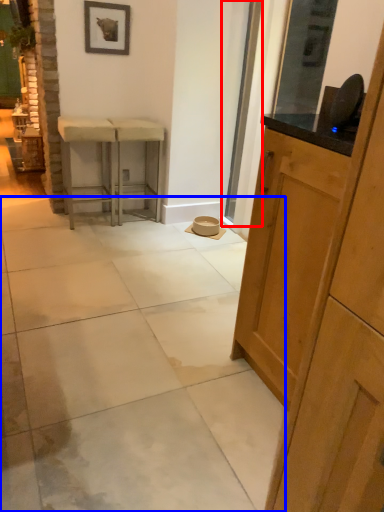
Question: Which of the following is the closest to the observer, screen door (highlighted by a red box) or concrete (highlighted by a blue box)?

Choices:
 (A) screen door
 (B) concrete

Answer: (B)